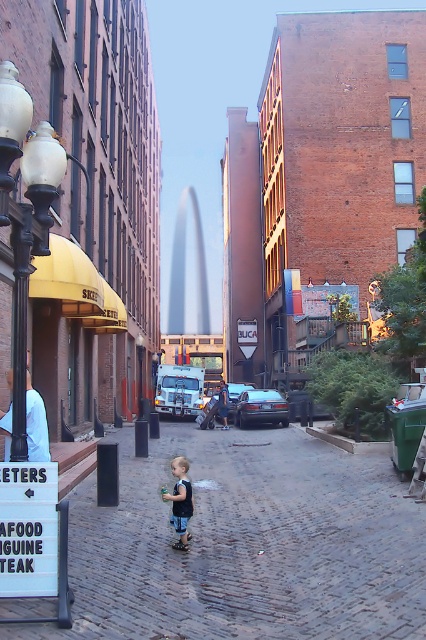
From the picture: You are a delivery person with a cart that is 2 meters wide. You need to move from the black glass lamp post at left to the cobblestone pavement at center. Can your cart fit through the space between them?

The distance between the cobblestone pavement at center and the black glass lamp post at left is 4.32 meters. Since your cart is 2 meters wide, it can easily fit through the space as 4.32 meters is greater than 2 meters.

You are a pedestrian trying to cross the street safely. You see the cobblestone pavement at center and the black glass lamp post at left. Which object is closer to the ground?

The cobblestone pavement at center is below the black glass lamp post at left, so it is closer to the ground.